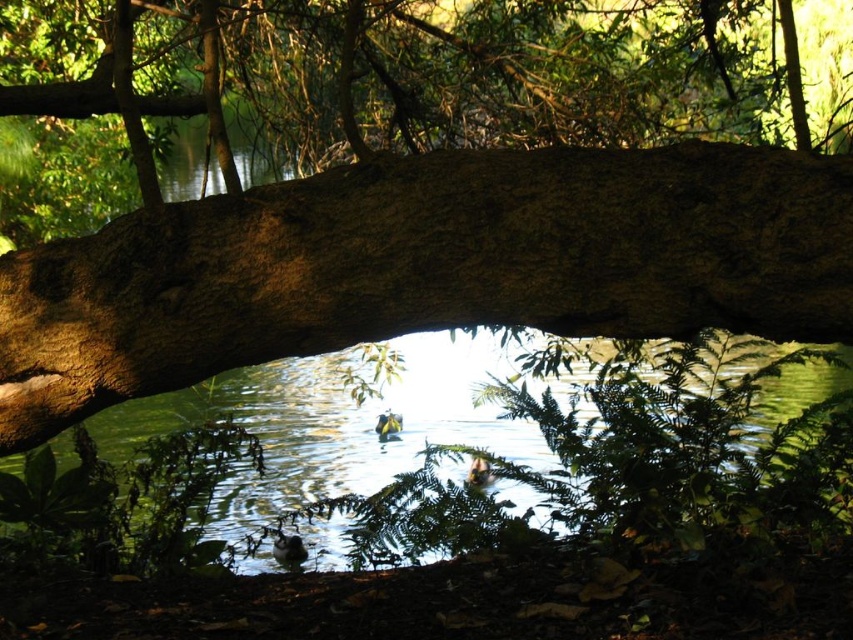
Which is more to the left, brown rough tree trunk at center or green liquid water at center?

Positioned to the left is green liquid water at center.

Between brown rough tree trunk at center and green liquid water at center, which one appears on the right side from the viewer's perspective?

brown rough tree trunk at center is more to the right.

This screenshot has height=640, width=853. What are the coordinates of `brown rough tree trunk at center` in the screenshot? It's located at (426, 266).